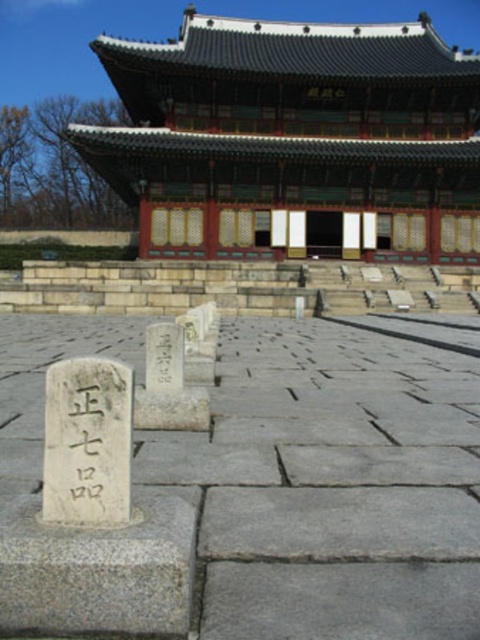
Question: Which is farther from the white stone marker at center?

Choices:
 (A) black stone writing at center
 (B) black stone writing at lower left

Answer: (A)

Question: Is green wooden palace at upper center wider than black stone writing at lower left?

Choices:
 (A) no
 (B) yes

Answer: (B)

Question: Which of these objects is positioned farthest from the black stone writing at lower left?

Choices:
 (A) black stone writing at center
 (B) white stone marker at center

Answer: (B)

Question: Which object appears closest to the camera in this image?

Choices:
 (A) black stone writing at center
 (B) green wooden palace at upper center

Answer: (A)

Question: Is white stone marker at center smaller than green wooden palace at upper center?

Choices:
 (A) no
 (B) yes

Answer: (B)

Question: Can you confirm if white stone marker at center is positioned below black stone writing at lower left?

Choices:
 (A) no
 (B) yes

Answer: (B)